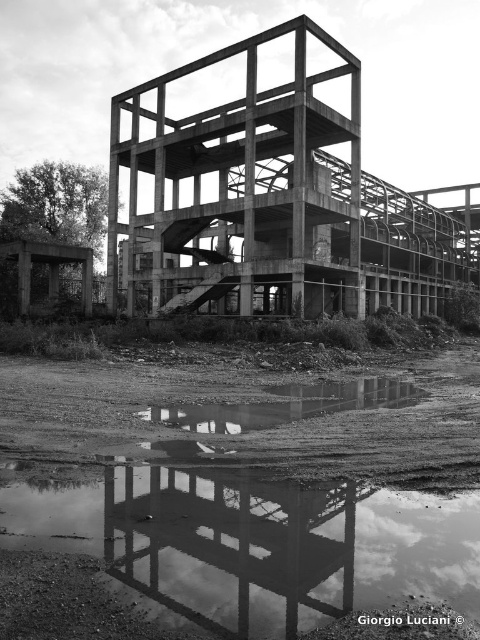
You are standing at the entrance of the abandoned industrial structure and see the point at coordinates point [250,488]. What is located at that point?

The transparent water at lower center is located at point [250,488].